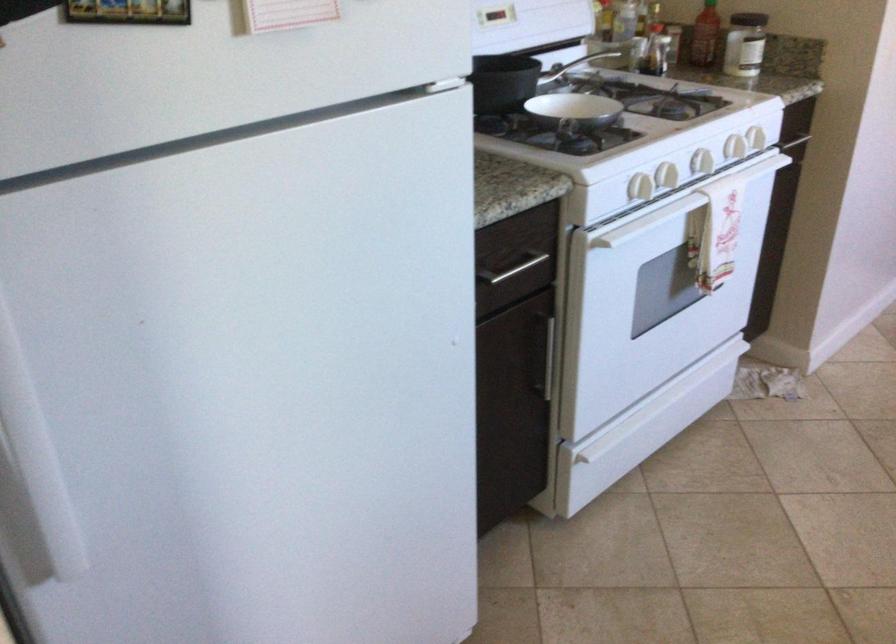
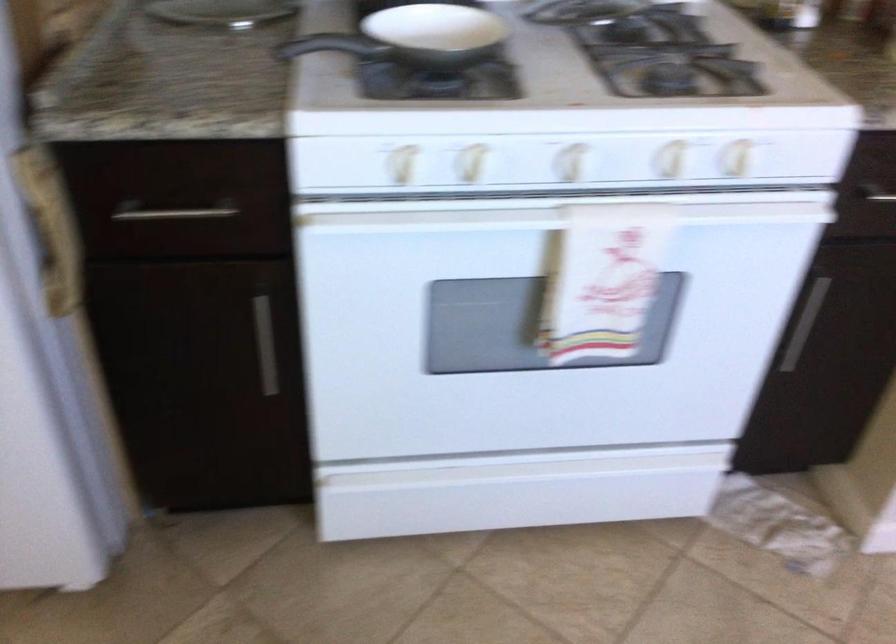
The point at (553,330) is marked in the first image. Where is the corresponding point in the second image?

(264, 345)